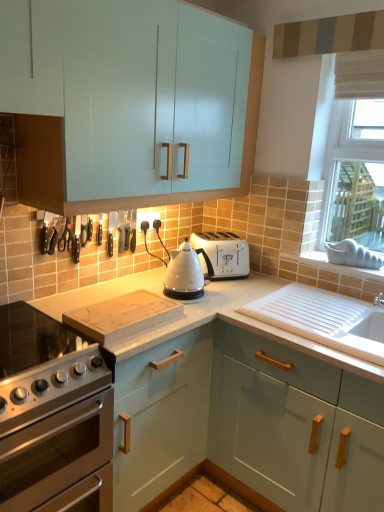
Describe the element at coordinates (334, 140) in the screenshot. The height and width of the screenshot is (512, 384). I see `white fabric window at upper right` at that location.

Find the location of a particular element. The image size is (384, 512). white marble cutting board at lower center is located at coordinates (245, 409).

What is the approximate height of glossy teal cabinet at lower right, which is the first cabinetry in bottom-to-top order?

34.86 inches.

What is the approximate height of white ceramic sink at lower right?

white ceramic sink at lower right is 4.58 centimeters tall.

This screenshot has height=512, width=384. Describe the element at coordinates (184, 274) in the screenshot. I see `white glossy kettle at center` at that location.

This screenshot has width=384, height=512. What are the coordinates of `white glossy kettle at center` in the screenshot? It's located at (184, 274).

This screenshot has height=512, width=384. Find the location of `white fabric window at upper right`. white fabric window at upper right is located at coordinates (334, 140).

Is white plastic toaster at upper center taller than matte striped panel at upper center?

Correct, white plastic toaster at upper center is much taller as matte striped panel at upper center.

Does white plastic toaster at upper center appear on the left side of matte striped panel at upper center?

Correct, you'll find white plastic toaster at upper center to the left of matte striped panel at upper center.

Between point (229, 264) and point (306, 42), which one is positioned behind?

Positioned behind is point (229, 264).

Identify the location of toaster behind the white ceramic sink at lower right. (222, 254).

Is white ceramic sink at lower right spatially inside white plastic toaster at upper center, or outside of it?

white ceramic sink at lower right is not inside white plastic toaster at upper center, it's outside.

Considering the sizes of white ceramic sink at lower right and white plastic toaster at upper center in the image, is white ceramic sink at lower right wider or thinner than white plastic toaster at upper center?

white ceramic sink at lower right is wider than white plastic toaster at upper center.

Can you see white ceramic sink at lower right touching white plastic toaster at upper center?

white ceramic sink at lower right is not next to white plastic toaster at upper center, and they're not touching.

Considering the relative positions of white plastic toaster at upper center and white fabric window at upper right in the image provided, is white plastic toaster at upper center behind white fabric window at upper right?

Yes, white plastic toaster at upper center is further from the camera.

Which is nearer, (241, 239) or (346, 118)?

Point (241, 239) is farther from the camera than point (346, 118).

From a real-world perspective, which object rests below the other?

white plastic toaster at upper center is physically lower.

Measure the distance between white plastic toaster at upper center and white fabric window at upper right.

white plastic toaster at upper center is 61.24 centimeters from white fabric window at upper right.

From the image's perspective, which one is positioned higher, matte white cabinet at upper center, placed as the second cabinetry when sorted from bottom to top, or white glossy kettle at center?

matte white cabinet at upper center, placed as the second cabinetry when sorted from bottom to top.

Identify the location of cabinetry that appears above the white glossy kettle at center (from the image's perspective). This screenshot has width=384, height=512. (129, 103).

Is matte white cabinet at upper center, placed as the second cabinetry when sorted from bottom to top, facing away from white glossy kettle at center?

No.

Is the surface of matte white cabinet at upper center, placed as the second cabinetry when sorted from bottom to top, in direct contact with white glossy kettle at center?

No, matte white cabinet at upper center, placed as the second cabinetry when sorted from bottom to top, is not making contact with white glossy kettle at center.

Does point (302, 42) lie behind point (68, 330)?

Yes, point (302, 42) is farther from viewer.

Would you say matte striped panel at upper center is to the left or to the right of satin silver gas stove at lower left in the picture?

matte striped panel at upper center is positioned on satin silver gas stove at lower left's right side.

From a real-world perspective, is matte striped panel at upper center on top of satin silver gas stove at lower left?

Indeed, from a real-world perspective, matte striped panel at upper center stands above satin silver gas stove at lower left.

From a real-world perspective, is white ceramic sink at lower right located higher than matte striped panel at upper center?

No, from a real-world perspective, white ceramic sink at lower right is not on top of matte striped panel at upper center.

Considering the sizes of objects white ceramic sink at lower right and matte striped panel at upper center in the image provided, who is thinner, white ceramic sink at lower right or matte striped panel at upper center?

matte striped panel at upper center.

I want to click on sink in front of the matte striped panel at upper center, so click(324, 319).

How far apart are white ceramic sink at lower right and matte striped panel at upper center?

white ceramic sink at lower right is 1.15 meters from matte striped panel at upper center.

This screenshot has height=512, width=384. Identify the location of oven below the satin silver gas stove at lower left (from the image's perspective). (56, 453).

Who is bigger, satin silver gas stove at lower left or stainless steel oven at lower left?

stainless steel oven at lower left is bigger.

Does point (42, 351) come closer to viewer compared to point (40, 444)?

No.

How different are the orientations of satin silver gas stove at lower left and stainless steel oven at lower left in degrees?

The angle between the facing direction of satin silver gas stove at lower left and the facing direction of stainless steel oven at lower left is 0.000126 degrees.

Where is `toaster beneath the matte striped panel at upper center (from a real-world perspective)`? toaster beneath the matte striped panel at upper center (from a real-world perspective) is located at coordinates (222, 254).

The width and height of the screenshot is (384, 512). What are the coordinates of `toaster located on the left of white ceramic sink at lower right` in the screenshot? It's located at (222, 254).

From the image, which object appears to be farther from satin silver gas stove at lower left, white fabric window at upper right or wooden cutting board at center?

Among the two, white fabric window at upper right is located further to satin silver gas stove at lower left.

In the scene shown: Which object lies further to the anchor point wooden cutting board at center, matte striped panel at upper center or white fabric window at upper right?

matte striped panel at upper center is positioned further to the anchor wooden cutting board at center.

Considering their positions, is satin silver gas stove at lower left positioned closer to white fabric window at upper right than stainless steel oven at lower left?

Among the two, satin silver gas stove at lower left is located nearer to white fabric window at upper right.

From the image, which object appears to be nearer to white marble cutting board at lower center, matte white cabinet at upper center, the 1th cabinetry in the top-to-bottom sequence, or white ceramic sink at lower right?

The object closer to white marble cutting board at lower center is white ceramic sink at lower right.

When comparing their distances from white glossy kettle at center, does satin silver gas stove at lower left or matte striped panel at upper center seem closer?

Based on the image, satin silver gas stove at lower left appears to be nearer to white glossy kettle at center.

Looking at the image, which one is located further to wooden cutting board at center, white marble cutting board at lower center or glossy teal cabinet at lower right, which is the first cabinetry in bottom-to-top order?

glossy teal cabinet at lower right, which is the first cabinetry in bottom-to-top order, lies further to wooden cutting board at center than the other object.

Considering their positions, is white plastic toaster at upper center positioned closer to stainless steel oven at lower left than white ceramic sink at lower right?

white ceramic sink at lower right lies closer to stainless steel oven at lower left than the other object.

Estimate the real-world distances between objects in this image. Which object is further from white fabric window at upper right, stainless steel oven at lower left or glossy teal cabinet at lower right, which is the first cabinetry in bottom-to-top order?

stainless steel oven at lower left lies further to white fabric window at upper right than the other object.

This screenshot has width=384, height=512. What are the coordinates of `kitchen appliance between satin silver gas stove at lower left and white plastic toaster at upper center from front to back` in the screenshot? It's located at (184, 274).

This screenshot has width=384, height=512. Identify the location of sink that lies between white fabric window at upper right and white marble cutting board at lower center from top to bottom. (324, 319).

Locate an element on the screen. The width and height of the screenshot is (384, 512). sink between white glossy kettle at center and white fabric window at upper right from left to right is located at coordinates (324, 319).

The image size is (384, 512). Find the location of `window between matte striped panel at upper center and white ceramic sink at lower right in the up-down direction`. window between matte striped panel at upper center and white ceramic sink at lower right in the up-down direction is located at coordinates (334, 140).